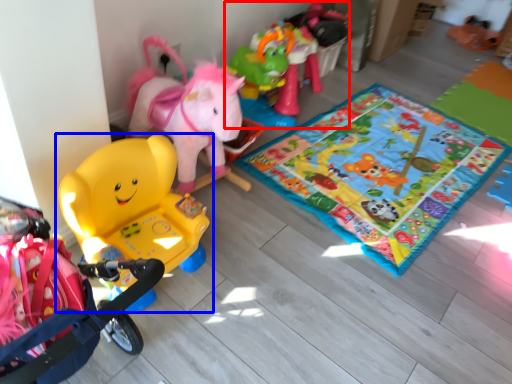
Question: Which object is further to the camera taking this photo, toy (highlighted by a red box) or toy (highlighted by a blue box)?

Choices:
 (A) toy
 (B) toy

Answer: (A)